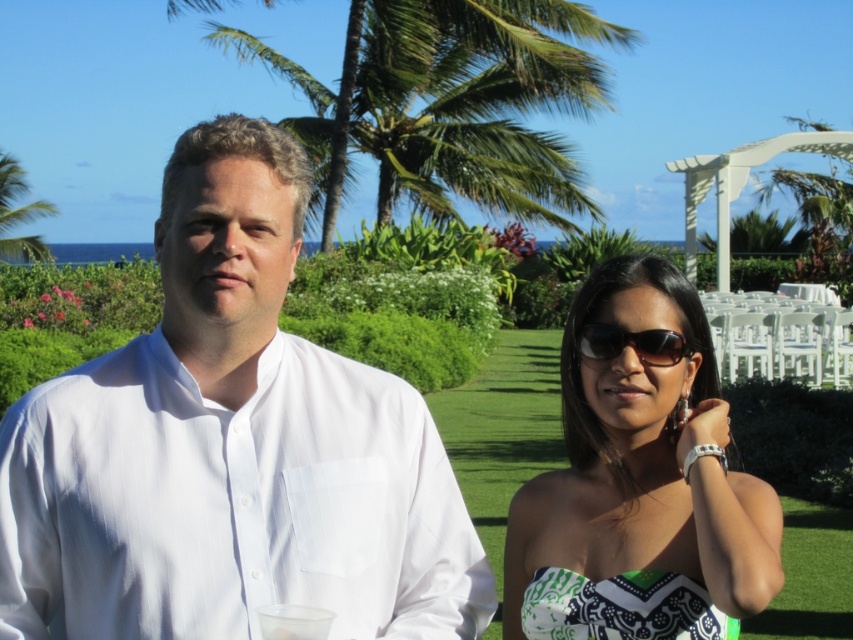
Does green leafy palm tree at upper left have a smaller size compared to black plastic sunglasses at center?

No, green leafy palm tree at upper left is not smaller than black plastic sunglasses at center.

Who is taller, green leafy palm tree at upper left or black plastic sunglasses at center?

green leafy palm tree at upper left

Where is `green leafy palm tree at upper left`? green leafy palm tree at upper left is located at coordinates (19, 214).

Is point (67, 572) positioned before point (32, 204)?

Yes, point (67, 572) is closer to viewer.

Consider the image. Who is positioned more to the left, white smooth shirt at left or green leafy palm tree at upper left?

green leafy palm tree at upper left

This screenshot has width=853, height=640. What do you see at coordinates (231, 449) in the screenshot?
I see `white smooth shirt at left` at bounding box center [231, 449].

At what (x,y) coordinates should I click in order to perform the action: click on white smooth shirt at left. Please return your answer as a coordinate pair (x, y). Image resolution: width=853 pixels, height=640 pixels. Looking at the image, I should click on (231, 449).

In the scene shown: Can you confirm if green printed dress at center is positioned above green printed fabric dress at lower right?

Correct, green printed dress at center is located above green printed fabric dress at lower right.

Who is taller, green printed dress at center or green printed fabric dress at lower right?

Standing taller between the two is green printed dress at center.

Measure the distance between green printed dress at center and camera.

They are 2.33 meters apart.

The width and height of the screenshot is (853, 640). Identify the location of green printed dress at center. (639, 480).